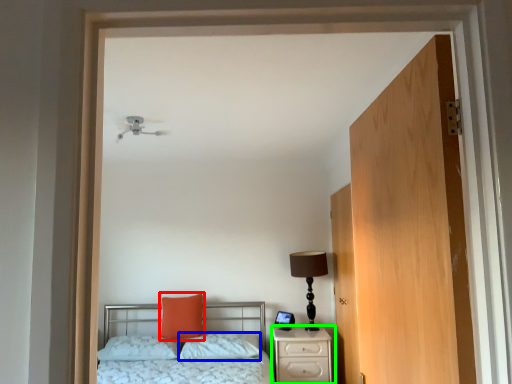
Question: Based on their relative distances, which object is nearer to pillow (highlighted by a red box)? Choose from pillow (highlighted by a blue box) and nightstand (highlighted by a green box).

Choices:
 (A) pillow
 (B) nightstand

Answer: (A)